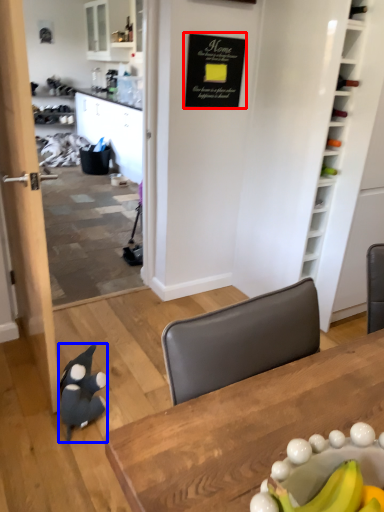
Question: Which object is further to the camera taking this photo, bulletin board (highlighted by a red box) or penguin (highlighted by a blue box)?

Choices:
 (A) bulletin board
 (B) penguin

Answer: (A)